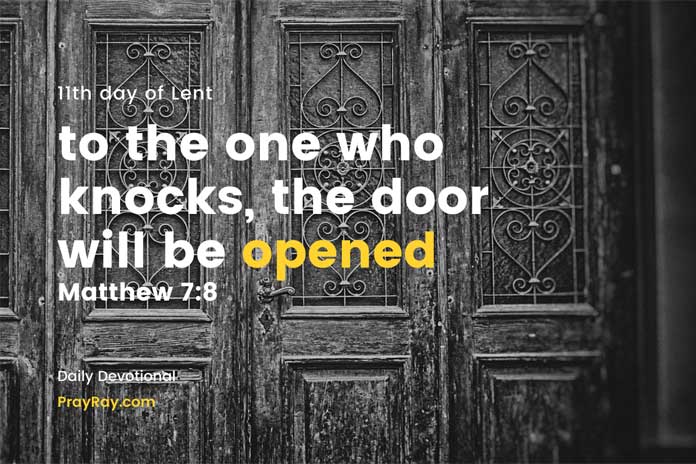
Where is `keyhole`? keyhole is located at coordinates click(264, 319).